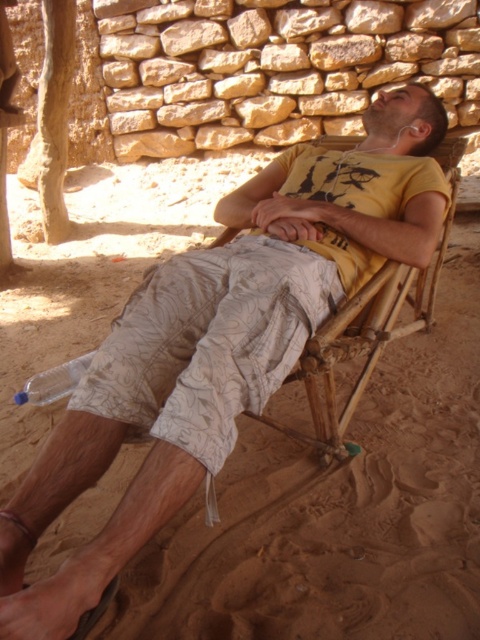
Who is more forward, (180, 410) or (320, 358)?

Point (180, 410) is in front.

Between white textured shorts at center and bamboo beach chair at center, which one appears on the right side from the viewer's perspective?

bamboo beach chair at center is more to the right.

Is point (141, 416) farther from camera compared to point (325, 392)?

No, (141, 416) is closer to viewer.

The height and width of the screenshot is (640, 480). I want to click on white textured shorts at center, so click(208, 340).